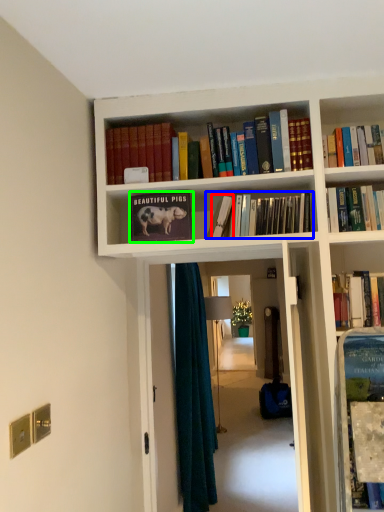
Question: Which is farther away from book (highlighted by a red box)? book (highlighted by a blue box) or book (highlighted by a green box)?

Choices:
 (A) book
 (B) book

Answer: (B)